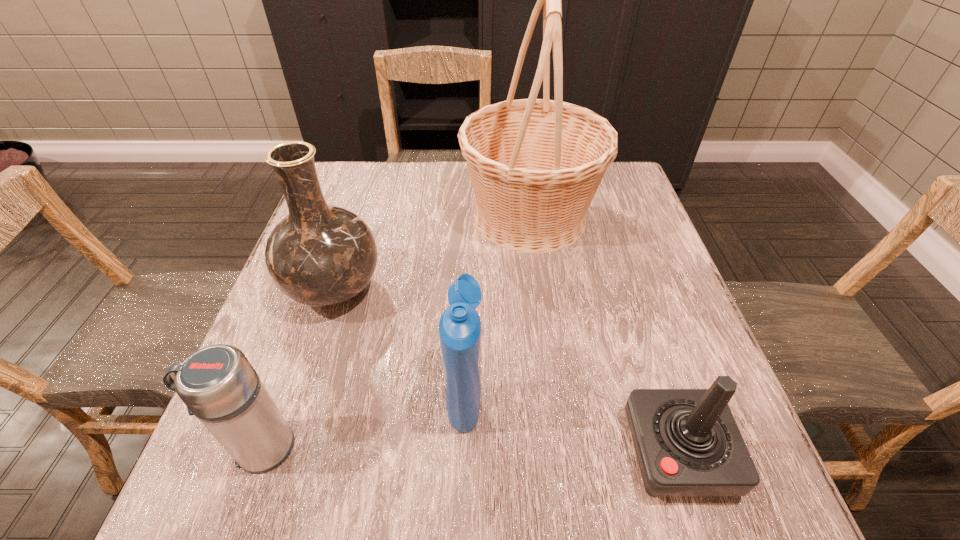
The height and width of the screenshot is (540, 960). What are the coordinates of `the tallest object` in the screenshot? It's located at (535, 164).

You are a GUI agent. You are given a task and a screenshot of the screen. Output one action in this format:
    pyautogui.click(x=<x>, y=<y>)
    Task: Click on the fourth shortest object
    The width and height of the screenshot is (960, 540).
    Given the screenshot: What is the action you would take?
    pyautogui.click(x=320, y=255)

Locate an element on the screen. This screenshot has height=540, width=960. shampoo is located at coordinates (460, 326).

Identify the location of thermos bottle. (217, 383).

Locate an element on the screen. joystick is located at coordinates (687, 442).

What are the coordinates of `vacant space situated 0.090m on the front of the basket` in the screenshot? It's located at (540, 292).

Where is `free region located on the right of the vase`? free region located on the right of the vase is located at coordinates (484, 291).

This screenshot has height=540, width=960. Identify the location of vacant space located 0.060m on the back of the shampoo. (467, 333).

Where is `vacant region located on the front-facing side of the joystick`? This screenshot has width=960, height=540. vacant region located on the front-facing side of the joystick is located at coordinates 588,452.

You are a GUI agent. You are given a task and a screenshot of the screen. Output one action in this format:
    pyautogui.click(x=<x>, y=<y>)
    Task: Click on the blank area located 0.220m on the front-facing side of the joystick
    The width and height of the screenshot is (960, 540).
    Given the screenshot: What is the action you would take?
    pyautogui.click(x=494, y=452)